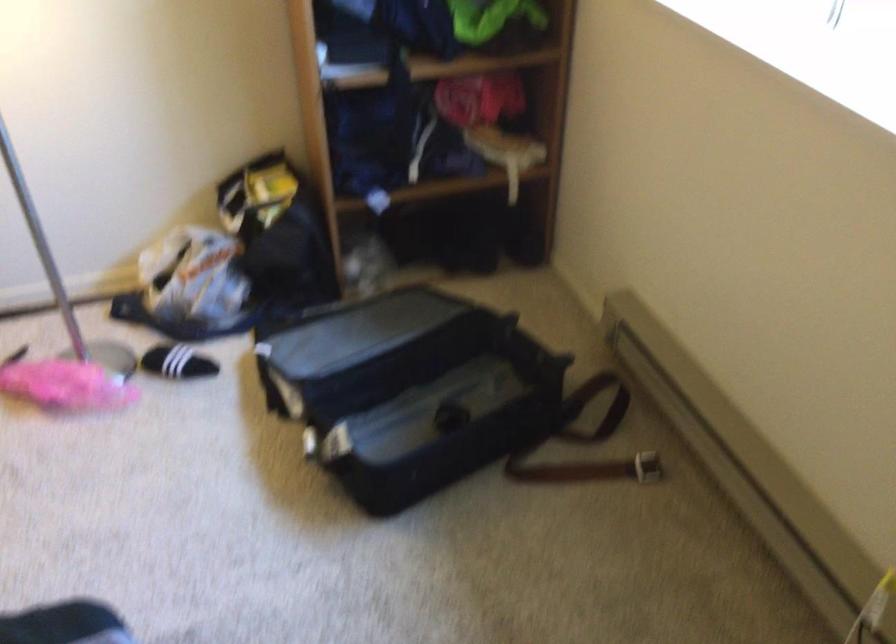
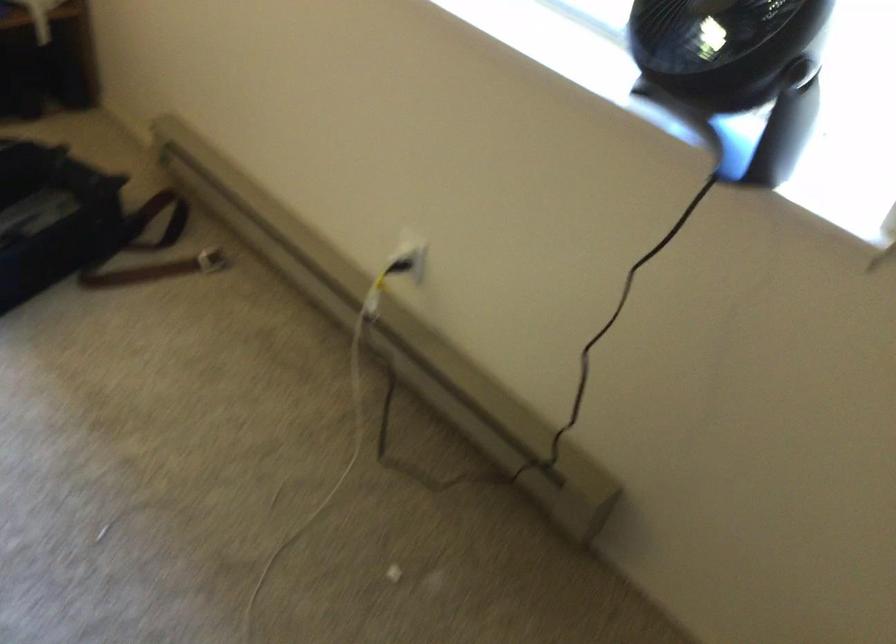
Question: What movement of the cameraman would produce the second image?

Choices:
 (A) Left
 (B) Right
 (C) Forward
 (D) Backward

Answer: (D)